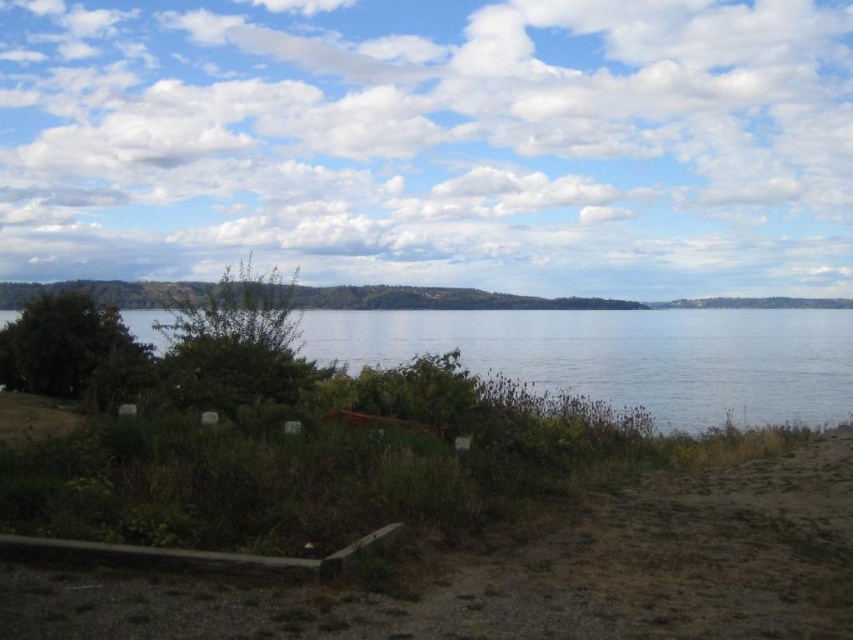
You are standing at the lakeside and want to locate two points marked in the image. The first point is at coordinates point (553, 548) and the second is at point (424, 330). Which of these points is closer to you?

Point (553, 548) is closer to the viewer than point (424, 330).

You are standing at the lakeside and want to reach a specific point marked as point (769, 612). Considering the distance, can you walk directly to it without any obstacles?

The distance between you and point (769, 612) is 6.86 meters. Since the scene describes a serene lakeside with a wooden railing at the bottom left and sparse vegetation, there are no mentioned obstacles blocking your path. Therefore, you can walk directly to the point.